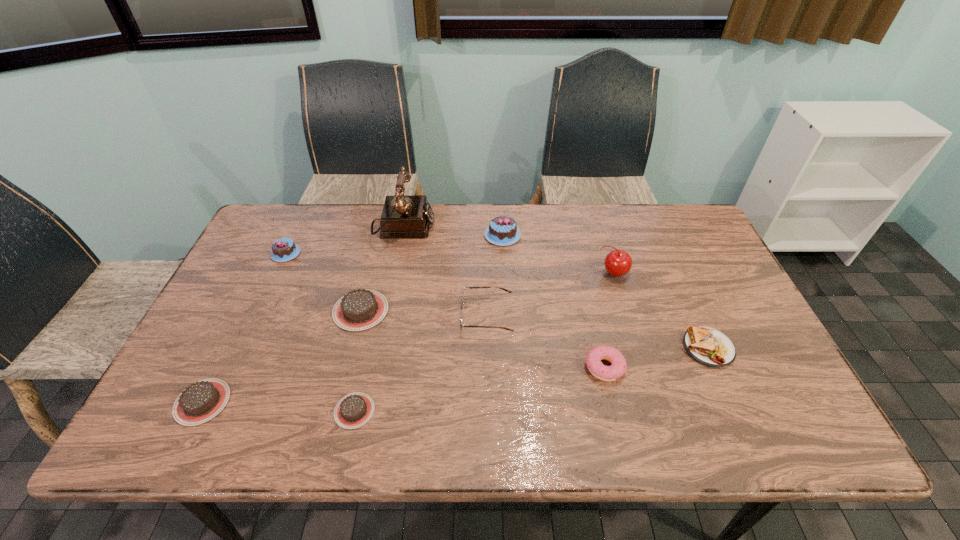
This screenshot has height=540, width=960. Find the location of `telephone that is at the far edge`. telephone that is at the far edge is located at coordinates (403, 216).

Identify the location of object that is at the right edge. (x=708, y=346).

Image resolution: width=960 pixels, height=540 pixels. In order to click on object at the far left corner in this screenshot , I will do tap(285, 249).

At what (x,y) coordinates should I click in order to perform the action: click on object at the near left corner. Please return your answer as a coordinate pair (x, y). Looking at the image, I should click on (201, 401).

Find the location of a particular element. Image resolution: width=960 pixels, height=540 pixels. vacant space at the far edge of the desktop is located at coordinates (615, 244).

Locate an element on the screen. The image size is (960, 540). free point at the near edge is located at coordinates (502, 443).

The height and width of the screenshot is (540, 960). In the image, there is a desktop. Find the location of `free space at the left edge`. free space at the left edge is located at coordinates (259, 340).

You are a GUI agent. You are given a task and a screenshot of the screen. Output one action in this format:
    pyautogui.click(x=<x>, y=<y>)
    Task: Click on the blank space at the right edge
    
    Given the screenshot: What is the action you would take?
    pyautogui.click(x=700, y=257)

Where is `blank region between the fourth farthest object and the shortest object`? blank region between the fourth farthest object and the shortest object is located at coordinates (484, 342).

Locate an element on the screen. free space between the rightmost object and the third farthest chocolate cake is located at coordinates (535, 329).